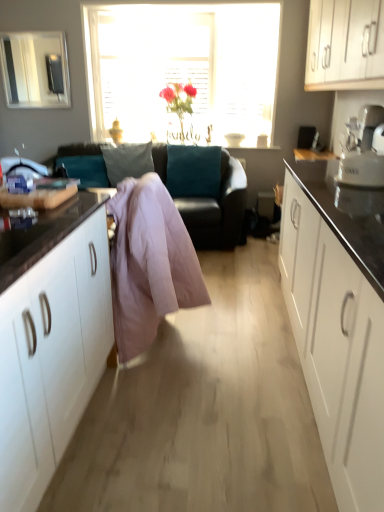
Question: Is translucent glass vase at center at the left side of teal leather couch at center?

Choices:
 (A) no
 (B) yes

Answer: (A)

Question: Is translucent glass vase at center looking in the opposite direction of teal leather couch at center?

Choices:
 (A) no
 (B) yes

Answer: (A)

Question: Could you tell me if translucent glass vase at center is turned towards teal leather couch at center?

Choices:
 (A) yes
 (B) no

Answer: (B)

Question: Considering the relative sizes of translucent glass vase at center and teal leather couch at center in the image provided, is translucent glass vase at center taller than teal leather couch at center?

Choices:
 (A) no
 (B) yes

Answer: (B)

Question: Is translucent glass vase at center thinner than teal leather couch at center?

Choices:
 (A) yes
 (B) no

Answer: (A)

Question: From a real-world perspective, is translucent glass vase at center physically below teal leather couch at center?

Choices:
 (A) yes
 (B) no

Answer: (B)

Question: Does white glossy cabinets at upper right have a greater width compared to teal leather couch at center?

Choices:
 (A) no
 (B) yes

Answer: (A)

Question: Does white glossy cabinets at upper right have a smaller size compared to teal leather couch at center?

Choices:
 (A) yes
 (B) no

Answer: (A)

Question: Is white glossy cabinets at upper right far away from teal leather couch at center?

Choices:
 (A) no
 (B) yes

Answer: (B)

Question: Is teal leather couch at center surrounded by white glossy cabinets at upper right?

Choices:
 (A) no
 (B) yes

Answer: (A)

Question: Considering the relative positions of white glossy cabinets at upper right and teal leather couch at center in the image provided, is white glossy cabinets at upper right in front of teal leather couch at center?

Choices:
 (A) no
 (B) yes

Answer: (B)

Question: Is white glossy cabinets at upper right outside of teal leather couch at center?

Choices:
 (A) no
 (B) yes

Answer: (B)

Question: Is teal leather couch at center beside translucent glass vase at center?

Choices:
 (A) yes
 (B) no

Answer: (B)